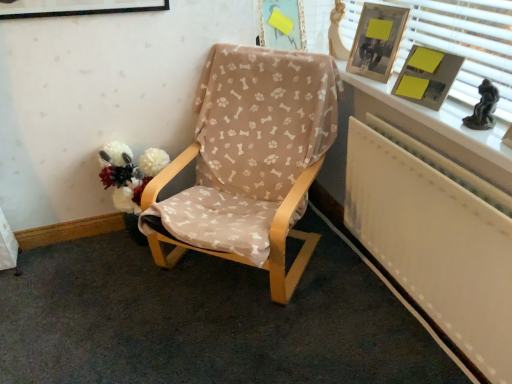
Question: Would you say white painted wood at upper right contains white painted wood at upper right?

Choices:
 (A) yes
 (B) no

Answer: (B)

Question: Is white painted wood at upper right taller than white painted wood at upper right?

Choices:
 (A) no
 (B) yes

Answer: (B)

Question: From the image's perspective, is white painted wood at upper right on top of white painted wood at upper right?

Choices:
 (A) yes
 (B) no

Answer: (A)

Question: Considering the relative sizes of white painted wood at upper right and white painted wood at upper right in the image provided, is white painted wood at upper right thinner than white painted wood at upper right?

Choices:
 (A) yes
 (B) no

Answer: (A)

Question: Does white painted wood at upper right have a larger size compared to white painted wood at upper right?

Choices:
 (A) yes
 (B) no

Answer: (B)

Question: Considering the relative positions of white painted wood at upper right and white painted wood at upper right in the image provided, is white painted wood at upper right in front of white painted wood at upper right?

Choices:
 (A) no
 (B) yes

Answer: (B)

Question: Considering the relative sizes of wooden picture frame at upper right, placed as the 1th picture frame when sorted from front to back, and white painted wood at upper right in the image provided, is wooden picture frame at upper right, placed as the 1th picture frame when sorted from front to back, taller than white painted wood at upper right?

Choices:
 (A) yes
 (B) no

Answer: (A)

Question: Considering the relative sizes of wooden picture frame at upper right, the second picture frame in the back-to-front sequence, and white painted wood at upper right in the image provided, is wooden picture frame at upper right, the second picture frame in the back-to-front sequence, bigger than white painted wood at upper right?

Choices:
 (A) yes
 (B) no

Answer: (B)

Question: Is wooden picture frame at upper right, placed as the 1th picture frame when sorted from front to back, behind white painted wood at upper right?

Choices:
 (A) no
 (B) yes

Answer: (B)

Question: From the image's perspective, is wooden picture frame at upper right, which ranks as the 1th picture frame in right-to-left order, over white painted wood at upper right?

Choices:
 (A) no
 (B) yes

Answer: (B)

Question: Is wooden picture frame at upper right, placed as the second picture frame when sorted from left to right, shorter than white painted wood at upper right?

Choices:
 (A) yes
 (B) no

Answer: (B)

Question: Considering the relative positions of wooden picture frame at upper right, placed as the second picture frame when sorted from left to right, and white painted wood at upper right in the image provided, is wooden picture frame at upper right, placed as the second picture frame when sorted from left to right, to the left of white painted wood at upper right from the viewer's perspective?

Choices:
 (A) no
 (B) yes

Answer: (B)

Question: Considering the relative sizes of yellow paper at upper right and white painted wood at upper right in the image provided, is yellow paper at upper right thinner than white painted wood at upper right?

Choices:
 (A) no
 (B) yes

Answer: (A)